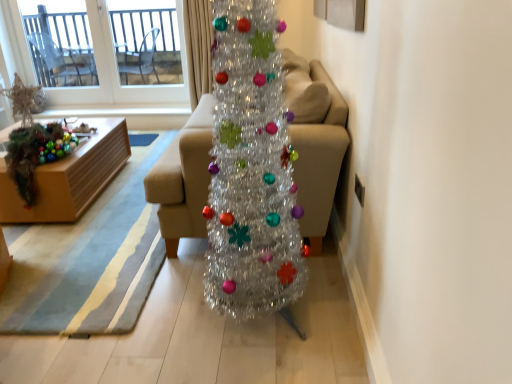
Question: Is transparent glass window at upper left looking in the opposite direction of shiny beige curtain at upper center?

Choices:
 (A) no
 (B) yes

Answer: (A)

Question: Considering the relative positions of transparent glass window at upper left and shiny beige curtain at upper center in the image provided, is transparent glass window at upper left behind shiny beige curtain at upper center?

Choices:
 (A) no
 (B) yes

Answer: (B)

Question: Is transparent glass window at upper left at the left side of shiny beige curtain at upper center?

Choices:
 (A) no
 (B) yes

Answer: (B)

Question: Is transparent glass window at upper left with shiny beige curtain at upper center?

Choices:
 (A) yes
 (B) no

Answer: (B)

Question: Can you confirm if transparent glass window at upper left is shorter than shiny beige curtain at upper center?

Choices:
 (A) no
 (B) yes

Answer: (A)

Question: Looking at the image, does transparent glass door at upper left seem bigger or smaller compared to shiny metallic christmas tree at center?

Choices:
 (A) small
 (B) big

Answer: (A)

Question: Considering the relative positions of transparent glass door at upper left and shiny metallic christmas tree at center in the image provided, is transparent glass door at upper left to the left or to the right of shiny metallic christmas tree at center?

Choices:
 (A) right
 (B) left

Answer: (B)

Question: Is transparent glass door at upper left wider or thinner than shiny metallic christmas tree at center?

Choices:
 (A) thin
 (B) wide

Answer: (A)

Question: Do you think transparent glass door at upper left is within shiny metallic christmas tree at center, or outside of it?

Choices:
 (A) inside
 (B) outside

Answer: (B)

Question: Is point (183, 172) closer or farther from the camera than point (245, 274)?

Choices:
 (A) closer
 (B) farther

Answer: (B)

Question: Is beige fabric couch at center wider or thinner than shiny metallic christmas tree at center?

Choices:
 (A) wide
 (B) thin

Answer: (A)

Question: Considering their positions, is beige fabric couch at center located in front of or behind shiny metallic christmas tree at center?

Choices:
 (A) behind
 (B) front

Answer: (A)

Question: Based on their positions, is beige fabric couch at center located to the left or right of shiny metallic christmas tree at center?

Choices:
 (A) right
 (B) left

Answer: (B)

Question: In terms of height, does wooden box at left look taller or shorter compared to shiny beige curtain at upper center?

Choices:
 (A) short
 (B) tall

Answer: (A)

Question: Choose the correct answer: Is wooden box at left inside shiny beige curtain at upper center or outside it?

Choices:
 (A) inside
 (B) outside

Answer: (B)